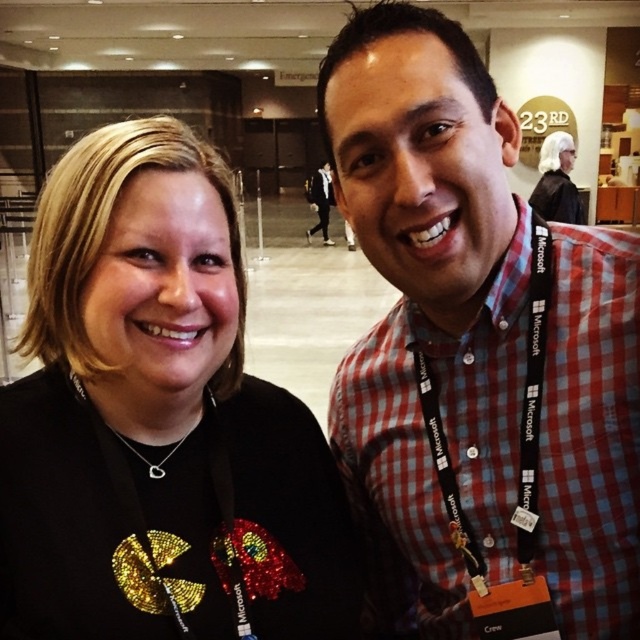
Question: Is black sequined shirt at center wider than black fabric lanyard at center?

Choices:
 (A) no
 (B) yes

Answer: (B)

Question: Which of the following is the farthest from the observer?

Choices:
 (A) (323, 209)
 (B) (548, 134)
 (C) (566, 314)

Answer: (A)

Question: Observing the image, what is the correct spatial positioning of black sequined shirt at center in reference to black fabric lanyard at center?

Choices:
 (A) right
 (B) left

Answer: (B)

Question: Which point is farther to the camera?

Choices:
 (A) black suit at center
 (B) red checkered shirt at right
 (C) black sequined shirt at center
 (D) black fabric lanyard at center

Answer: (A)

Question: Is red checkered shirt at right closer to the viewer compared to white hair wig at upper center?

Choices:
 (A) no
 (B) yes

Answer: (B)

Question: Which object is farther from the camera taking this photo?

Choices:
 (A) black fabric lanyard at center
 (B) red checkered shirt at right
 (C) white hair wig at upper center
 (D) black sequined shirt at center

Answer: (C)